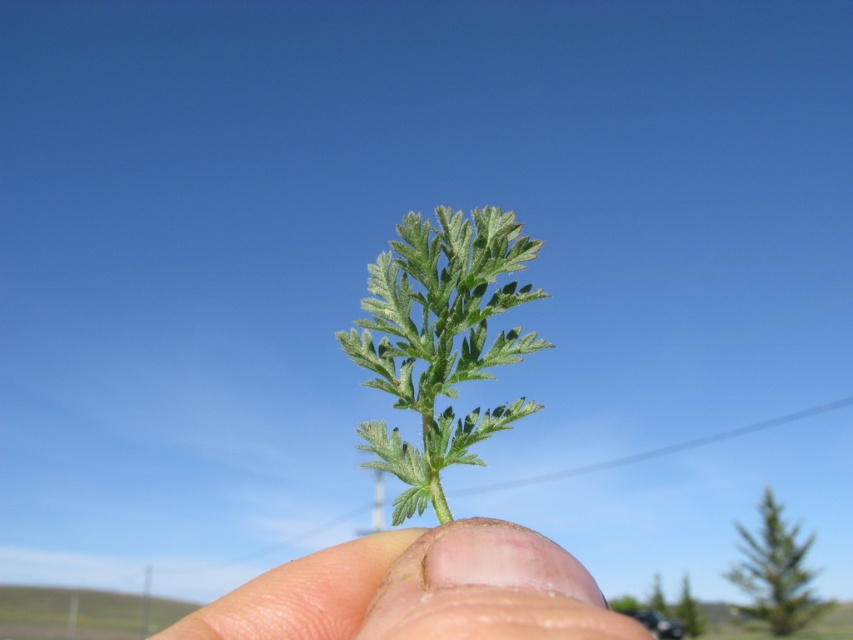
Question: Is fleshy skin at center smaller than green fuzzy leaf at center?

Choices:
 (A) yes
 (B) no

Answer: (B)

Question: Where is fleshy skin at center located in relation to green fuzzy leaf at center in the image?

Choices:
 (A) below
 (B) above

Answer: (A)

Question: Which point is closer to the camera?

Choices:
 (A) (425, 541)
 (B) (399, 316)

Answer: (A)

Question: Observing the image, what is the correct spatial positioning of fleshy skin at center in reference to green fuzzy leaf at center?

Choices:
 (A) left
 (B) right

Answer: (A)

Question: Which object appears closest to the camera in this image?

Choices:
 (A) green fuzzy leaf at center
 (B) fleshy skin at center

Answer: (B)